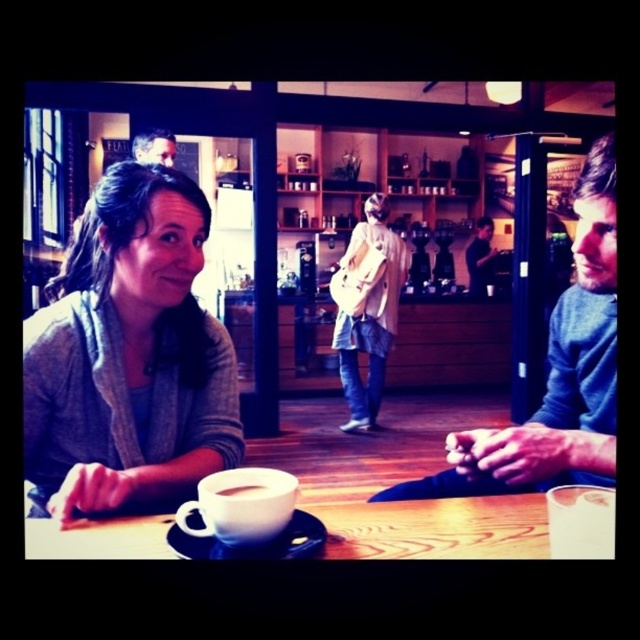
Question: Among these objects, which one is farthest from the camera?

Choices:
 (A) wooden table at center
 (B) blue sweater at right
 (C) white ceramic mug at center

Answer: (B)

Question: Is white matte cup at lower center below white matte mug at center?

Choices:
 (A) yes
 (B) no

Answer: (B)

Question: Can you confirm if smooth leather jacket at upper center is positioned below white matte mug at center?

Choices:
 (A) yes
 (B) no

Answer: (B)

Question: Which of the following is the farthest from the observer?

Choices:
 (A) black matte saucer at lower center
 (B) denim jacket at center
 (C) dark blue sweater at right

Answer: (C)

Question: Which point is farther to the camera?

Choices:
 (A) (476, 289)
 (B) (275, 536)
 (C) (54, 532)
 (D) (140, 150)

Answer: (A)

Question: Does denim jacket at center lie behind smooth leather jacket at upper center?

Choices:
 (A) yes
 (B) no

Answer: (A)